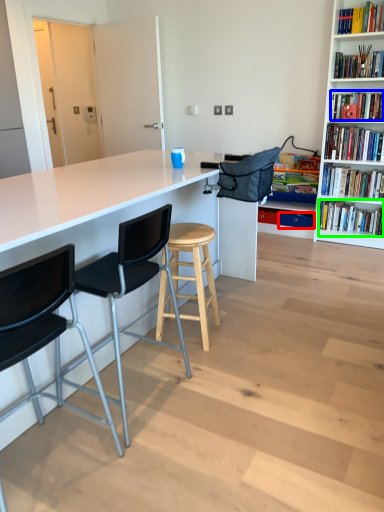
Question: Considering the real-world distances, which object is farthest from drawer (highlighted by a red box)? book (highlighted by a blue box) or book (highlighted by a green box)?

Choices:
 (A) book
 (B) book

Answer: (A)